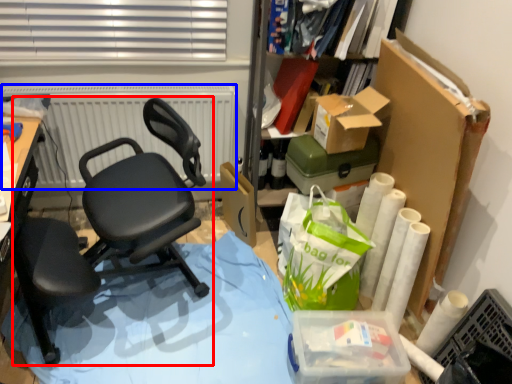
Question: Which point is closer to the camera, chair (highlighted by a red box) or radiator (highlighted by a blue box)?

Choices:
 (A) chair
 (B) radiator

Answer: (A)